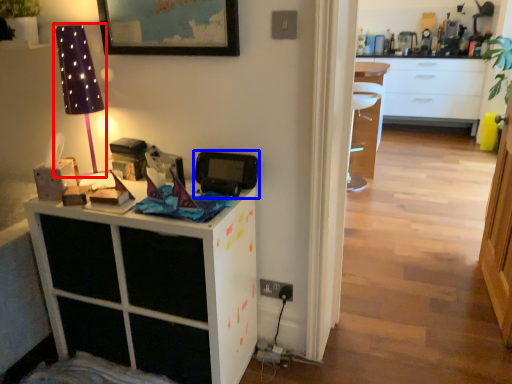
Question: Among these objects, which one is nearest to the camera, table lamp (highlighted by a red box) or appliance (highlighted by a blue box)?

Choices:
 (A) table lamp
 (B) appliance

Answer: (A)